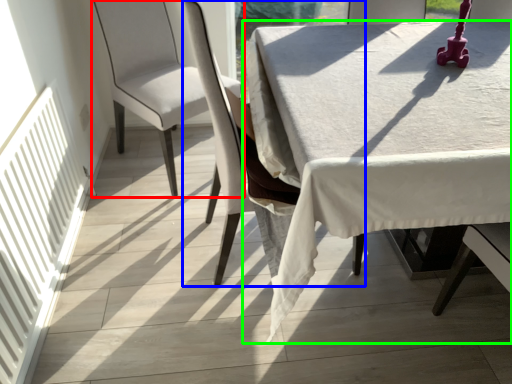
Question: Based on their relative distances, which object is farther from chair (highlighted by a red box)? Choose from chair (highlighted by a blue box) and table (highlighted by a green box).

Choices:
 (A) chair
 (B) table

Answer: (B)